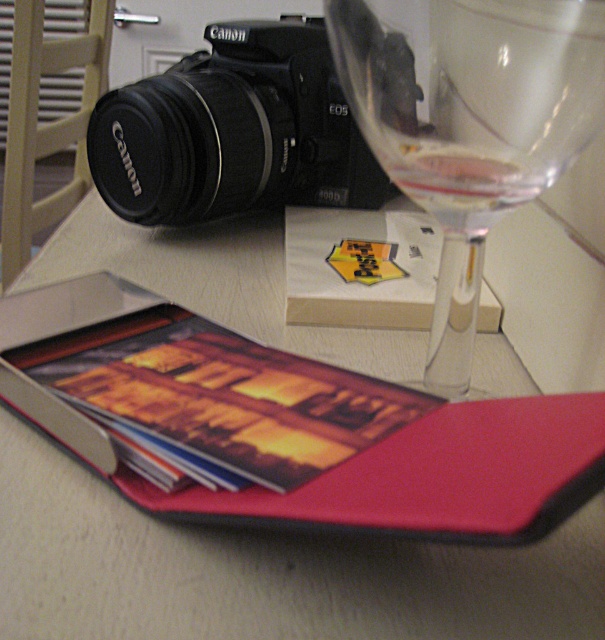
Can you confirm if transparent glass wine glass at upper right is bigger than black matte canon camera at upper left?

No, transparent glass wine glass at upper right is not bigger than black matte canon camera at upper left.

Between transparent glass wine glass at upper right and black matte canon camera at upper left, which one has more height?

With more height is black matte canon camera at upper left.

Who is more distant from viewer, [361,35] or [159,109]?

Positioned behind is point [159,109].

This screenshot has width=605, height=640. Find the location of `transparent glass wine glass at upper right`. transparent glass wine glass at upper right is located at coordinates (469, 115).

Is matte plastic tray at upper left to the left of transparent glass wine glass at upper right from the viewer's perspective?

Correct, you'll find matte plastic tray at upper left to the left of transparent glass wine glass at upper right.

Is point (284, 628) farther from viewer compared to point (387, 74)?

No, (284, 628) is closer to viewer.

Image resolution: width=605 pixels, height=640 pixels. What are the coordinates of `matte plastic tray at upper left` in the screenshot? It's located at (263, 572).

Which is behind, point (255, 285) or point (396, 179)?

The point (255, 285) is more distant.

Is matte plastic tray at upper left closer to camera compared to clear glass wine at upper right?

Yes, it is.

Which is behind, point (41, 516) or point (505, 208)?

Positioned behind is point (505, 208).

You are a GUI agent. You are given a task and a screenshot of the screen. Output one action in this format:
    pyautogui.click(x=<x>, y=<y>)
    Task: Click on the matte plastic tray at upper left
    The height and width of the screenshot is (640, 605).
    Given the screenshot: What is the action you would take?
    pyautogui.click(x=263, y=572)